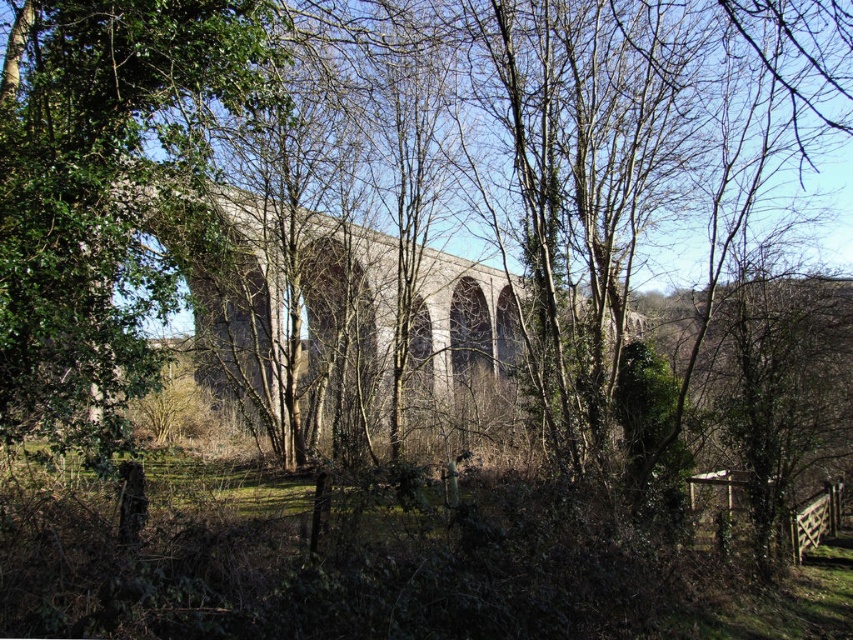
Can you confirm if green leafy tree at center is taller than concrete arches at center?

Incorrect, green leafy tree at center's height is not larger of concrete arches at center's.

At what (x,y) coordinates should I click in order to perform the action: click on green leafy tree at center. Please return your answer as a coordinate pair (x, y). Looking at the image, I should click on (97, 188).

Locate an element on the screen. green leafy tree at center is located at coordinates (97, 188).